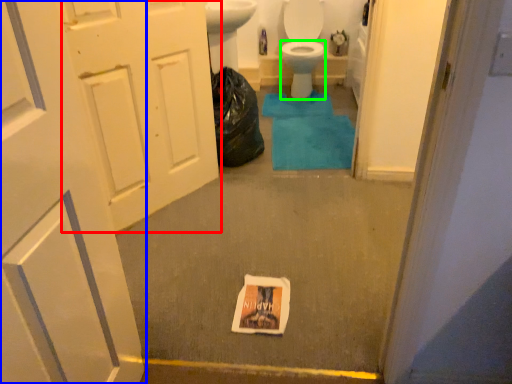
Question: Which object is the farthest from door (highlighted by a red box)? Choose among these: door (highlighted by a blue box) or bidet (highlighted by a green box).

Choices:
 (A) door
 (B) bidet

Answer: (B)